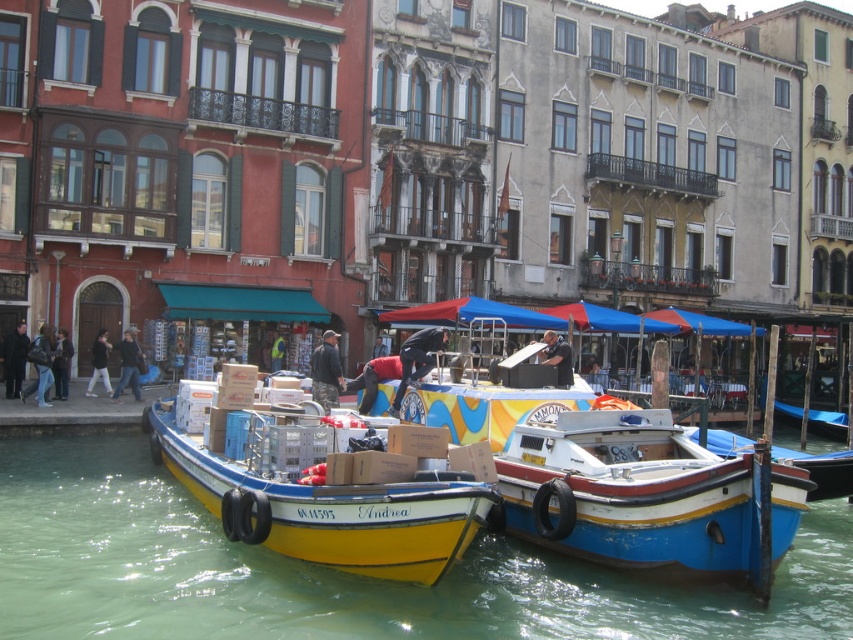
You are standing on the dock and see the green water at boat center and the yellow matte boat at center. Which object is positioned to the right when looking at them from the dock?

The green water at boat center is to the right of the yellow matte boat at center.

You are standing on the dock and see the yellow matte boat at center and the dark gray fabric jacket at lower left. Which object is positioned to the right of the other?

The yellow matte boat at center is positioned to the right of the dark gray fabric jacket at lower left.

You are a tourist standing at the edge of the canal in Venice. You notice a black fabric jacket at center. Based on its position, can you determine if it is closer to the left boat or the right boat?

The black fabric jacket at center is located at point (416, 358), which places it closer to the right boat.